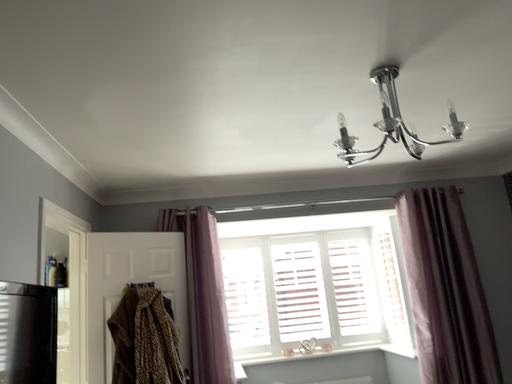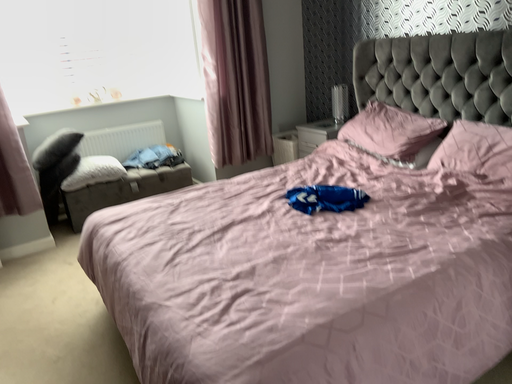
Question: How did the camera likely rotate when shooting the video?

Choices:
 (A) rotated upward
 (B) rotated downward

Answer: (B)